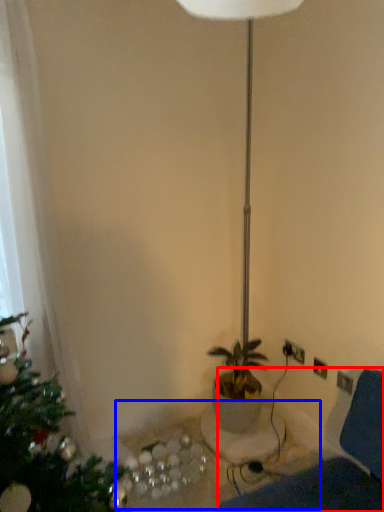
Question: Which of the following is the closest to the observer, swivel chair (highlighted by a red box) or table (highlighted by a blue box)?

Choices:
 (A) swivel chair
 (B) table

Answer: (A)